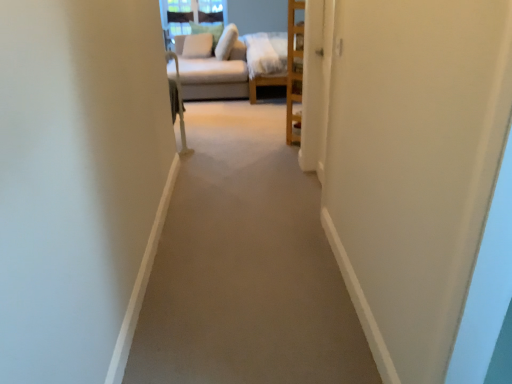
Question: Is carpet at center situated inside light beige fabric pillow at upper center, which ranks as the second pillow in right-to-left order, or outside?

Choices:
 (A) inside
 (B) outside

Answer: (B)

Question: Considering their positions, is carpet at center located in front of or behind light beige fabric pillow at upper center, the second pillow viewed from the left?

Choices:
 (A) behind
 (B) front

Answer: (B)

Question: Considering the real-world distances, which object is farthest from the beige fabric couch at upper center?

Choices:
 (A) white soft pillow at upper center, the 1th pillow from the left
 (B) light beige fabric pillow at upper center, which ranks as the second pillow in right-to-left order
 (C) carpet at center
 (D) white soft pillow at upper center, which is the 1th pillow from right to left

Answer: (C)

Question: Estimate the real-world distances between objects in this image. Which object is farther from the light beige fabric pillow at upper center, the second pillow viewed from the left?

Choices:
 (A) white soft pillow at upper center, placed as the third pillow when sorted from left to right
 (B) carpet at center
 (C) beige fabric couch at upper center
 (D) white soft pillow at upper center, the 1th pillow from the left

Answer: (B)